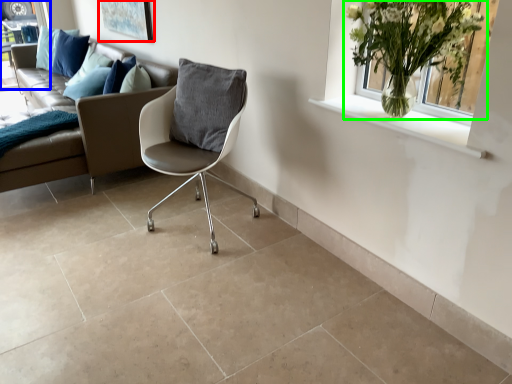
Question: Which is nearer to the picture frame (highlighted by a red box)? window frame (highlighted by a blue box) or houseplant (highlighted by a green box).

Choices:
 (A) window frame
 (B) houseplant

Answer: (A)